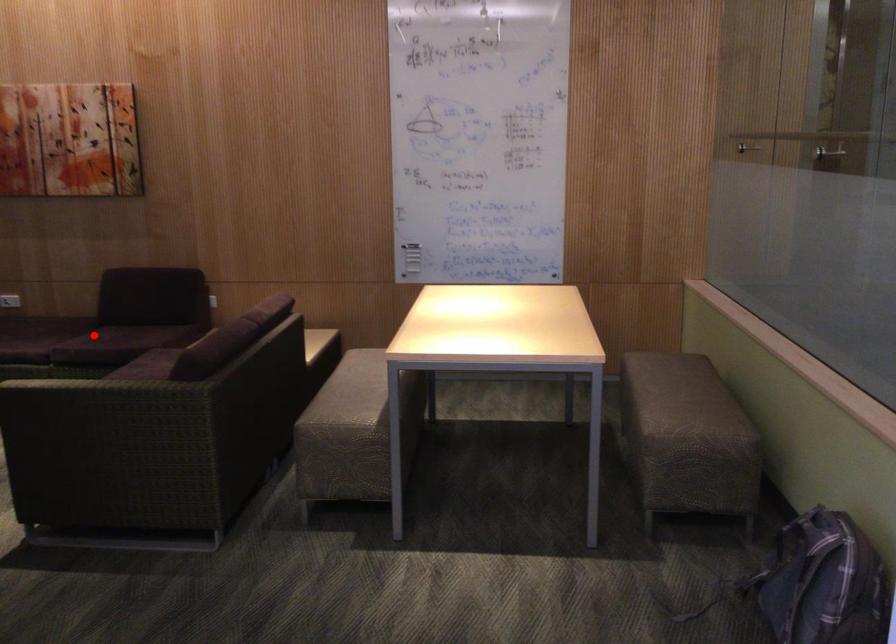
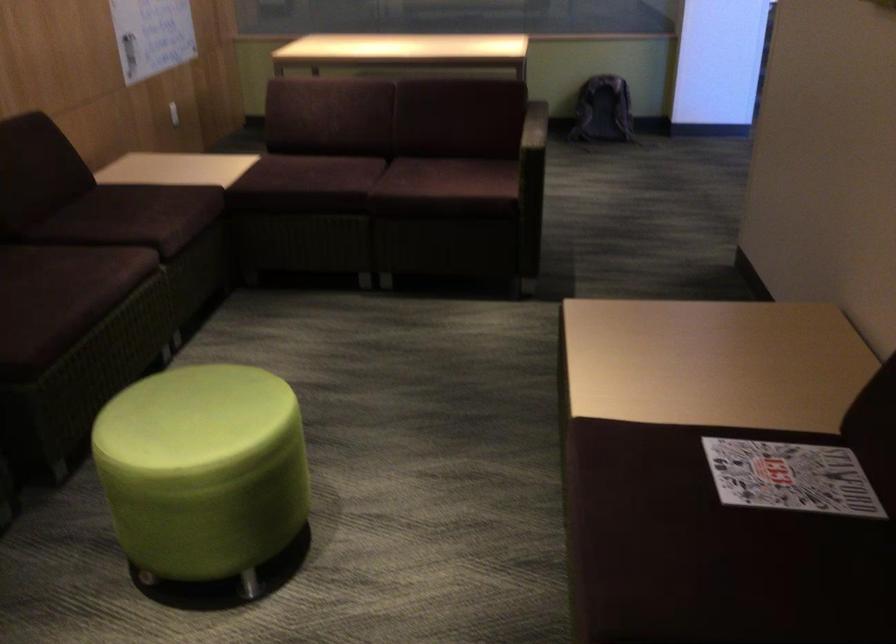
Locate, in the second image, the point that corresponds to the highlighted location in the first image.

(147, 214)